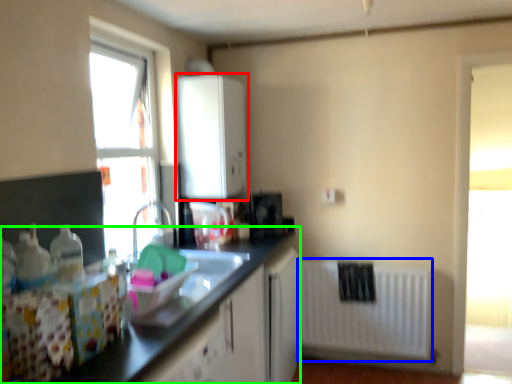
Question: Estimate the real-world distances between objects in this image. Which object is farther from cabinetry (highlighted by a red box), radiator (highlighted by a blue box) or countertop (highlighted by a green box)?

Choices:
 (A) radiator
 (B) countertop

Answer: (A)